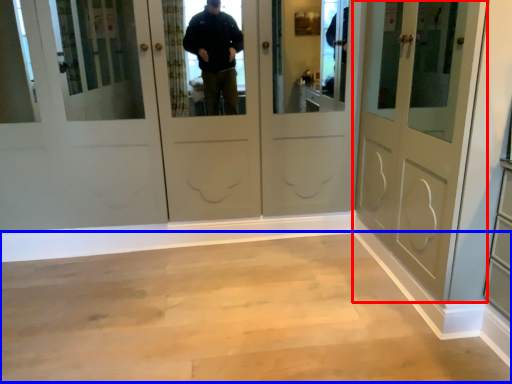
Question: Which object appears farthest to the camera in this image, door (highlighted by a red box) or corridor (highlighted by a blue box)?

Choices:
 (A) door
 (B) corridor

Answer: (B)